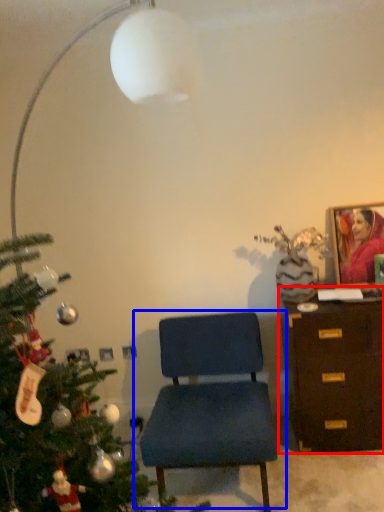
Question: Which point is further to the camera, chest of drawers (highlighted by a red box) or chair (highlighted by a blue box)?

Choices:
 (A) chest of drawers
 (B) chair

Answer: (A)